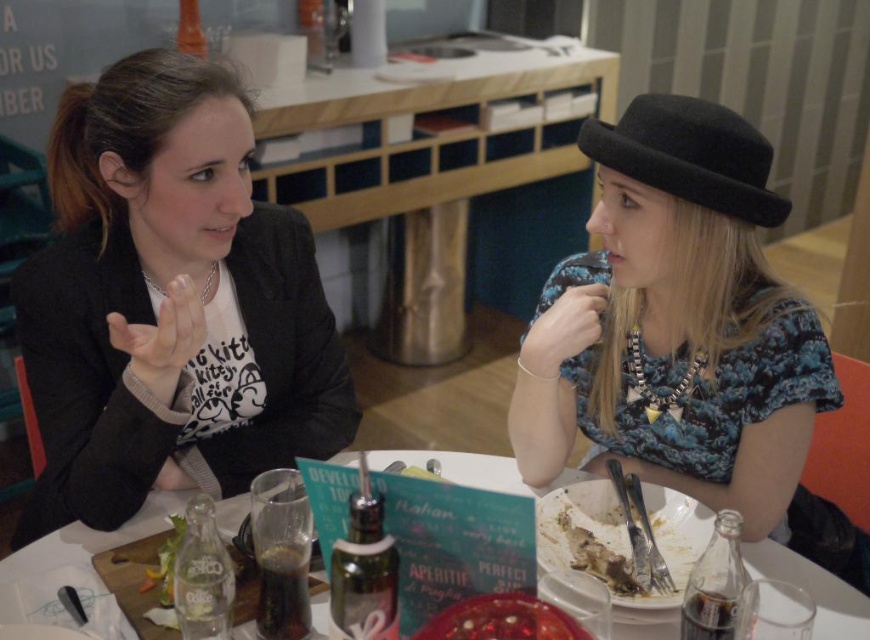
Question: Which point is farther to the camera?

Choices:
 (A) (744, 148)
 (B) (96, 445)

Answer: (B)

Question: Is white glossy table at center thinner than black felt plug hat at upper right?

Choices:
 (A) no
 (B) yes

Answer: (A)

Question: Which object is closer to the camera taking this photo?

Choices:
 (A) white glossy table at center
 (B) matte black blazer at left

Answer: (A)

Question: Which of the following is the closest to the observer?

Choices:
 (A) (191, 432)
 (B) (728, 173)

Answer: (B)

Question: Is matte black blazer at left thinner than black felt plug hat at upper right?

Choices:
 (A) yes
 (B) no

Answer: (B)

Question: Is white glossy table at center wider than black felt plug hat at upper right?

Choices:
 (A) no
 (B) yes

Answer: (B)